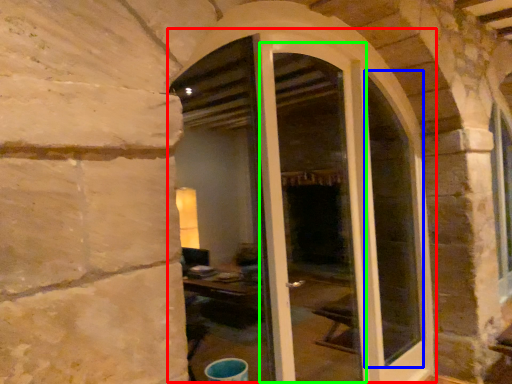
Question: Considering the real-world distances, which object is farthest from door (highlighted by a red box)? glass window (highlighted by a blue box) or screen door (highlighted by a green box)?

Choices:
 (A) glass window
 (B) screen door

Answer: (B)